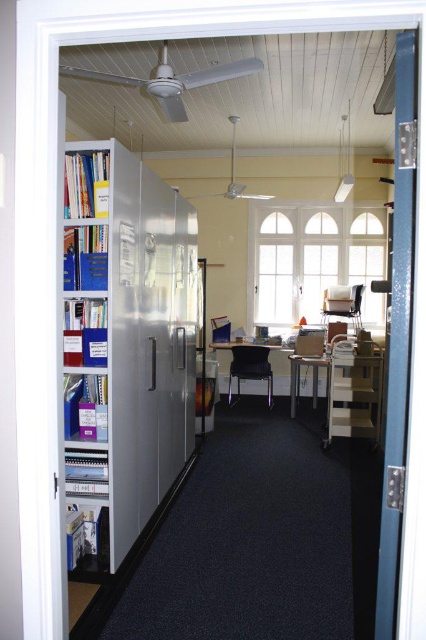
Question: Which of the following is the farthest from the observer?

Choices:
 (A) metallic gray bookcase at left
 (B) teal glossy door at right

Answer: (A)

Question: Does metallic gray bookcase at left appear on the right side of teal glossy door at right?

Choices:
 (A) no
 (B) yes

Answer: (A)

Question: Among these objects, which one is nearest to the camera?

Choices:
 (A) teal glossy door at right
 (B) metallic gray bookcase at left

Answer: (A)

Question: Which of the following is the closest to the observer?

Choices:
 (A) [152, 342]
 (B) [376, 636]

Answer: (B)

Question: Can you confirm if metallic gray bookcase at left is wider than teal glossy door at right?

Choices:
 (A) no
 (B) yes

Answer: (B)

Question: Is metallic gray bookcase at left positioned at the back of teal glossy door at right?

Choices:
 (A) yes
 (B) no

Answer: (A)